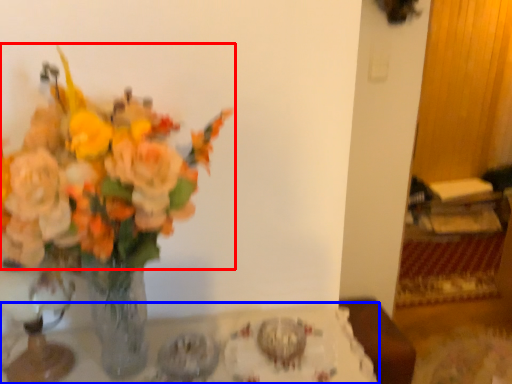
Question: Among these objects, which one is farthest to the camera, flower (highlighted by a red box) or table (highlighted by a blue box)?

Choices:
 (A) flower
 (B) table

Answer: (B)